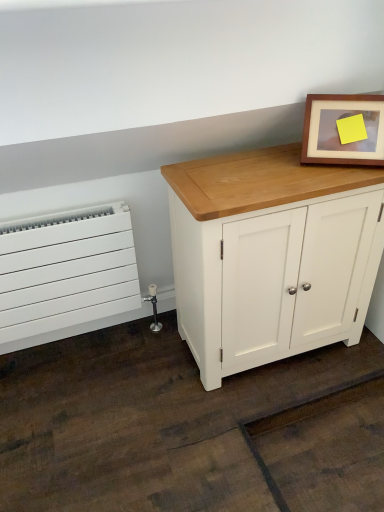
At what (x,y) coordinates should I click in order to perform the action: click on vacant space to the left of wooden picture frame at upper right. Please return your answer as a coordinate pair (x, y). This screenshot has height=512, width=384. Looking at the image, I should click on (286, 170).